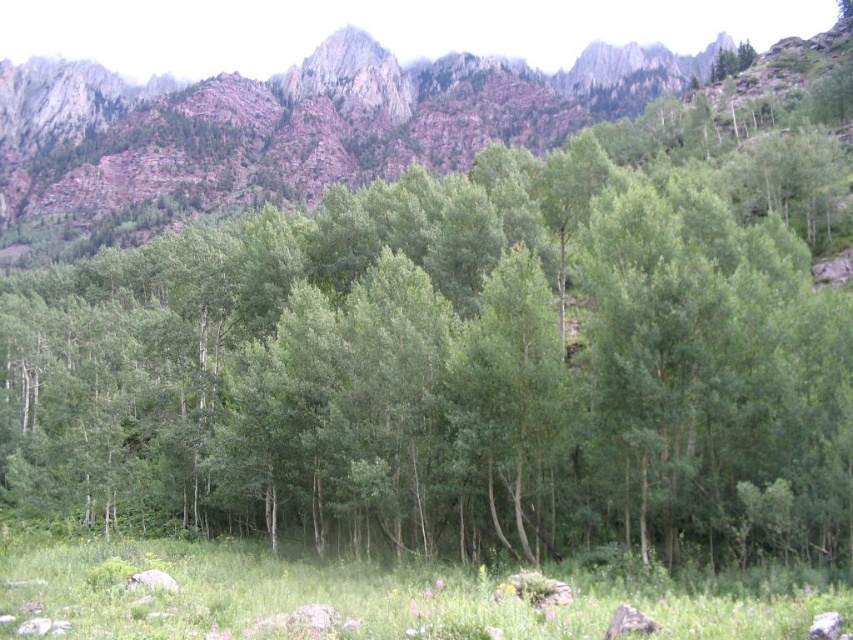
From the picture: You are a hiker planning to traverse from the green grassy field at lower center to the rustic rock mountain at upper center. Given that your average walking pace is 1.5 meters per second, approximately how many minutes will it take you to reach the mountain?

The distance between the rustic rock mountain at upper center and green grassy field at lower center is 229.60 meters. At a pace of 1.5 meters per second, dividing 229.60 by 1.5 gives approximately 153.07 seconds. Converting seconds to minutes by dividing by 60 results in roughly 2.55 minutes. Therefore, it will take approximately 2.55 minutes to reach the mountain.

You are standing in the middle of the green grassy field at lower center and want to reach the rustic rock mountain at upper center. Which direction should you move to get closer to the mountain?

You should move upward towards the rustic rock mountain at upper center since it is located above the green grassy field at lower center.

You are standing in the dense aspen forest in the foreground of the image. Looking towards the mountains in the background, where exactly would you see the rustic rock mountain marked by point (287, 129)?

The point (287, 129) marks the rustic rock mountain at upper center, so you would look towards the upper center area of the image to see it.